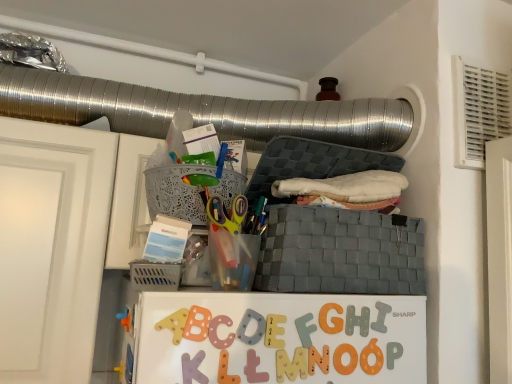
This screenshot has height=384, width=512. Describe the element at coordinates (381, 317) in the screenshot. I see `gray matte letter i at center, placed as the first alphabet when sorted from right to left` at that location.

Describe the element at coordinates (341, 359) in the screenshot. This screenshot has height=384, width=512. I see `orange matte letter at center, the first letter positioned from the bottom` at that location.

The width and height of the screenshot is (512, 384). What are the coordinates of `gray matte letter i at center, placed as the first alphabet when sorted from right to left` in the screenshot? It's located at (381, 317).

From the image's perspective, between gray matte letter i at center, the 6th alphabet in the left-to-right sequence, and orange matte letter at center, the first letter positioned from the bottom, which one is located above?

gray matte letter i at center, the 6th alphabet in the left-to-right sequence, is shown above in the image.

Where is `alphabet that appears behind the orange matte letter at center, the second letter from the top`? This screenshot has height=384, width=512. alphabet that appears behind the orange matte letter at center, the second letter from the top is located at coordinates (381, 317).

Is gray matte letter i at center, placed as the first alphabet when sorted from right to left, at the left side of orange matte letter at center, the first letter positioned from the bottom?

Incorrect, gray matte letter i at center, placed as the first alphabet when sorted from right to left, is not on the left side of orange matte letter at center, the first letter positioned from the bottom.

Is gray foam letter f at center, positioned as the third alphabet in right-to-left order, outside of matte plastic letter e at center, the second alphabet viewed from the left?

Absolutely, gray foam letter f at center, positioned as the third alphabet in right-to-left order, is external to matte plastic letter e at center, the second alphabet viewed from the left.

Is gray foam letter f at center, positioned as the third alphabet in right-to-left order, wider than matte plastic letter e at center, the second alphabet viewed from the left?

Indeed, gray foam letter f at center, positioned as the third alphabet in right-to-left order, has a greater width compared to matte plastic letter e at center, the second alphabet viewed from the left.

Are gray foam letter f at center, positioned as the 4th alphabet in left-to-right order, and matte plastic letter e at center, the second alphabet viewed from the left, located far from each other?

They are positioned close to each other.

Could you measure the distance between matte plastic letter m at center, acting as the 3th alphabet starting from the left, and orange foam letter g at center, arranged as the first letter when viewed from the top?

matte plastic letter m at center, acting as the 3th alphabet starting from the left, and orange foam letter g at center, arranged as the first letter when viewed from the top, are 3.10 inches apart.

From the image's perspective, between matte plastic letter m at center, arranged as the fourth alphabet when viewed from the right, and orange foam letter g at center, arranged as the first letter when viewed from the top, who is located below?

matte plastic letter m at center, arranged as the fourth alphabet when viewed from the right, appears lower in the image.

From a real-world perspective, is matte plastic letter m at center, arranged as the fourth alphabet when viewed from the right, positioned over orange foam letter g at center, the 2th letter positioned from the bottom, based on gravity?

Incorrect, from a real-world perspective, matte plastic letter m at center, arranged as the fourth alphabet when viewed from the right, is lower than orange foam letter g at center, the 2th letter positioned from the bottom.

Is matte plastic letter m at center, arranged as the fourth alphabet when viewed from the right, smaller than orange foam letter g at center, arranged as the first letter when viewed from the top?

Incorrect, matte plastic letter m at center, arranged as the fourth alphabet when viewed from the right, is not smaller in size than orange foam letter g at center, arranged as the first letter when viewed from the top.

What's the angular difference between gray woven basket at center, the first basket in the right-to-left sequence, and gray foam letter f at center, positioned as the 4th alphabet in left-to-right order,'s facing directions?

There is a 0.0133-degree angle between the facing directions of gray woven basket at center, the first basket in the right-to-left sequence, and gray foam letter f at center, positioned as the 4th alphabet in left-to-right order.

Is gray woven basket at center, the first basket in the right-to-left sequence, smaller than gray foam letter f at center, positioned as the third alphabet in right-to-left order?

Incorrect, gray woven basket at center, the first basket in the right-to-left sequence, is not smaller in size than gray foam letter f at center, positioned as the third alphabet in right-to-left order.

From a real-world perspective, which is physically below, gray woven basket at center, the first basket in the right-to-left sequence, or gray foam letter f at center, positioned as the 4th alphabet in left-to-right order?

gray foam letter f at center, positioned as the 4th alphabet in left-to-right order, from a real-world perspective.

Would you say gray woven basket at center, the first basket in the right-to-left sequence, is a long distance from gray foam letter f at center, positioned as the third alphabet in right-to-left order?

That's not correct — gray woven basket at center, the first basket in the right-to-left sequence, is a little close to gray foam letter f at center, positioned as the third alphabet in right-to-left order.

Does gray matte letter i at center, the 6th alphabet in the left-to-right sequence, have a lesser width compared to lacy plastic basket at upper center, the second basket positioned from the right?

Yes, gray matte letter i at center, the 6th alphabet in the left-to-right sequence, is thinner than lacy plastic basket at upper center, the second basket positioned from the right.

Is gray matte letter i at center, placed as the first alphabet when sorted from right to left, located outside lacy plastic basket at upper center, the 1th basket when ordered from left to right?

Yes.

From a real-world perspective, relative to lacy plastic basket at upper center, the second basket positioned from the right, is gray matte letter i at center, placed as the first alphabet when sorted from right to left, vertically above or below?

gray matte letter i at center, placed as the first alphabet when sorted from right to left, is below lacy plastic basket at upper center, the second basket positioned from the right.

Would you say orange matte letter at center, the second letter from the top, is part of matte plastic letter l at center, positioned as the 1th alphabet in left-to-right order,'s contents?

No, orange matte letter at center, the second letter from the top, is not surrounded by matte plastic letter l at center, positioned as the 1th alphabet in left-to-right order.

From the image's perspective, between matte plastic letter l at center, positioned as the 1th alphabet in left-to-right order, and orange matte letter at center, the first letter positioned from the bottom, which one is located above?

matte plastic letter l at center, positioned as the 1th alphabet in left-to-right order, appears higher in the image.

Is matte plastic letter l at center, positioned as the 1th alphabet in left-to-right order, oriented away from orange matte letter at center, the first letter positioned from the bottom?

Answer: matte plastic letter l at center, positioned as the 1th alphabet in left-to-right order, does not have its back to orange matte letter at center, the first letter positioned from the bottom.

Can you see gray matte letter i at center, the 6th alphabet in the left-to-right sequence, touching wooden letter n at center, which ranks as the 5th alphabet in left-to-right order?

No, gray matte letter i at center, the 6th alphabet in the left-to-right sequence, is not making contact with wooden letter n at center, which ranks as the 5th alphabet in left-to-right order.

Is gray matte letter i at center, the 6th alphabet in the left-to-right sequence, further to the viewer compared to wooden letter n at center, which ranks as the 5th alphabet in left-to-right order?

Yes, gray matte letter i at center, the 6th alphabet in the left-to-right sequence, is behind wooden letter n at center, which ranks as the 5th alphabet in left-to-right order.

From a real-world perspective, is gray matte letter i at center, placed as the first alphabet when sorted from right to left, physically located above or below wooden letter n at center, which ranks as the second alphabet in right-to-left order?

In terms of real-world spatial position, gray matte letter i at center, placed as the first alphabet when sorted from right to left, is above wooden letter n at center, which ranks as the second alphabet in right-to-left order.

From the image's perspective, would you say gray matte letter i at center, the 6th alphabet in the left-to-right sequence, is positioned over wooden letter n at center, which ranks as the second alphabet in right-to-left order?

Yes, from the image's perspective, gray matte letter i at center, the 6th alphabet in the left-to-right sequence, is over wooden letter n at center, which ranks as the second alphabet in right-to-left order.

The image size is (512, 384). I want to click on the 2nd letter in front of the gray matte letter i at center, placed as the first alphabet when sorted from right to left, so click(x=341, y=359).

From the matte plastic letter e at center, the second alphabet viewed from the left, count 2nd alphabet to the right and point to it. Please provide its 2D coordinates.

[(305, 329)]

Consider the image. Considering their positions, is gray matte letter i at center, placed as the first alphabet when sorted from right to left, positioned further to orange foam letter g at center, the 2th letter positioned from the bottom, than wooden letter n at center, which ranks as the 5th alphabet in left-to-right order?

The object further to orange foam letter g at center, the 2th letter positioned from the bottom, is gray matte letter i at center, placed as the first alphabet when sorted from right to left.

From the image, which object appears to be nearer to matte plastic letter l at center, positioned as the 1th alphabet in left-to-right order, gray matte letter i at center, the 6th alphabet in the left-to-right sequence, or gray foam letter f at center, positioned as the 4th alphabet in left-to-right order?

gray foam letter f at center, positioned as the 4th alphabet in left-to-right order, is positioned closer to the anchor matte plastic letter l at center, positioned as the 1th alphabet in left-to-right order.

Looking at this image, which object lies further to the anchor point orange foam letter g at center, arranged as the first letter when viewed from the top, gray woven basket at center, placed as the second basket when sorted from left to right, or gray foam letter f at center, positioned as the 4th alphabet in left-to-right order?

gray woven basket at center, placed as the second basket when sorted from left to right, is positioned further to the anchor orange foam letter g at center, arranged as the first letter when viewed from the top.

When comparing their distances from gray woven basket at center, placed as the second basket when sorted from left to right, does orange matte letter at center, the second letter from the top, or orange foam letter g at center, arranged as the first letter when viewed from the top, seem closer?

orange foam letter g at center, arranged as the first letter when viewed from the top, lies closer to gray woven basket at center, placed as the second basket when sorted from left to right, than the other object.

Considering their positions, is matte plastic letter e at center, placed as the fifth alphabet when sorted from right to left, positioned further to gray woven basket at center, placed as the second basket when sorted from left to right, than gray foam letter f at center, positioned as the third alphabet in right-to-left order?

matte plastic letter e at center, placed as the fifth alphabet when sorted from right to left.

From the image, which object appears to be nearer to matte plastic letter l at center, positioned as the 1th alphabet in left-to-right order, orange foam letter g at center, arranged as the first letter when viewed from the top, or gray woven basket at center, placed as the second basket when sorted from left to right?

orange foam letter g at center, arranged as the first letter when viewed from the top.

Considering their positions, is orange foam letter g at center, arranged as the first letter when viewed from the top, positioned closer to gray foam letter f at center, positioned as the third alphabet in right-to-left order, than gray matte letter i at center, placed as the first alphabet when sorted from right to left?

orange foam letter g at center, arranged as the first letter when viewed from the top, is closer to gray foam letter f at center, positioned as the third alphabet in right-to-left order.

Considering their positions, is matte plastic letter e at center, placed as the fifth alphabet when sorted from right to left, positioned further to gray woven basket at center, placed as the second basket when sorted from left to right, than matte plastic letter l at center, the sixth alphabet positioned from the right?

matte plastic letter l at center, the sixth alphabet positioned from the right, lies further to gray woven basket at center, placed as the second basket when sorted from left to right, than the other object.

Find the location of a particular element. This screenshot has width=512, height=384. letter between gray woven basket at center, placed as the second basket when sorted from left to right, and orange matte letter at center, the second letter from the top, in the vertical direction is located at coordinates (331, 318).

Identify the location of basket between gray foam letter f at center, positioned as the 4th alphabet in left-to-right order, and gray matte letter i at center, placed as the first alphabet when sorted from right to left, in the horizontal direction. Image resolution: width=512 pixels, height=384 pixels. [340, 252].

I want to click on letter between lacy plastic basket at upper center, the second basket positioned from the right, and matte plastic letter m at center, arranged as the fourth alphabet when viewed from the right, in the vertical direction, so [x=331, y=318].

This screenshot has height=384, width=512. Find the location of `letter between orange foam letter g at center, the 2th letter positioned from the bottom, and gray matte letter i at center, placed as the first alphabet when sorted from right to left, in the horizontal direction`. letter between orange foam letter g at center, the 2th letter positioned from the bottom, and gray matte letter i at center, placed as the first alphabet when sorted from right to left, in the horizontal direction is located at coordinates (341, 359).